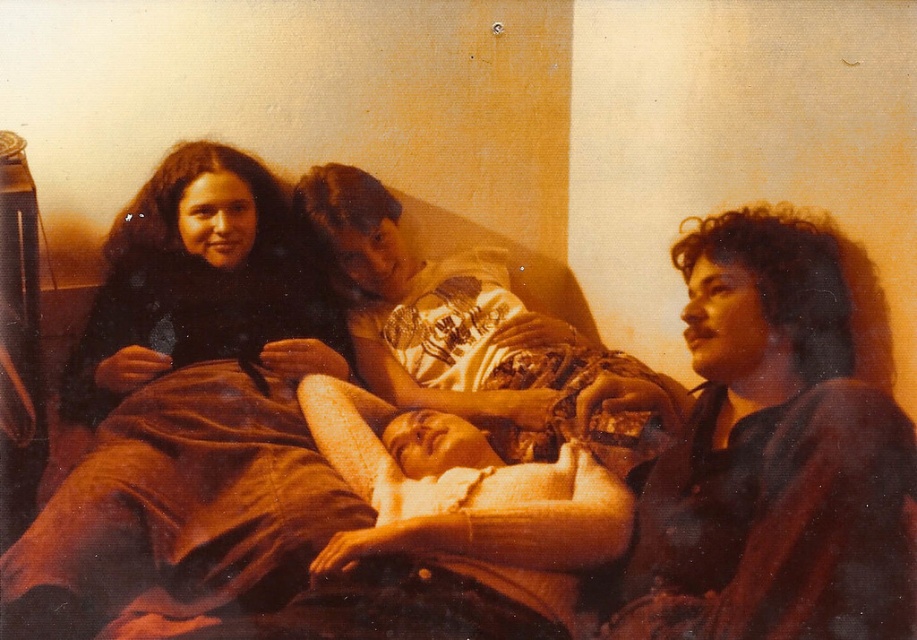
Question: Considering the relative positions of matte white shirt at center and dark brown fur scarf at left in the image provided, where is matte white shirt at center located with respect to dark brown fur scarf at left?

Choices:
 (A) above
 (B) below

Answer: (B)

Question: Does dark brown hair at right appear on the right side of dark brown fur scarf at left?

Choices:
 (A) no
 (B) yes

Answer: (B)

Question: Observing the image, what is the correct spatial positioning of dark brown hair at right in reference to matte white shirt at center?

Choices:
 (A) above
 (B) below

Answer: (B)

Question: Which point is farther to the camera?

Choices:
 (A) dark brown fur scarf at left
 (B) matte white shirt at center

Answer: (A)

Question: Which object is the farthest from the matte white shirt at center?

Choices:
 (A) dark brown fur scarf at left
 (B) dark brown hair at right

Answer: (B)

Question: Which object appears closest to the camera in this image?

Choices:
 (A) matte white shirt at center
 (B) dark brown fur scarf at left

Answer: (A)